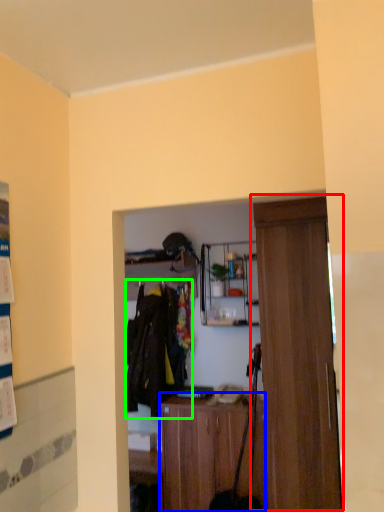
Question: Based on their relative distances, which object is nearer to door (highlighted by a red box)? Choose from cabinetry (highlighted by a blue box) and clothing (highlighted by a green box).

Choices:
 (A) cabinetry
 (B) clothing

Answer: (A)